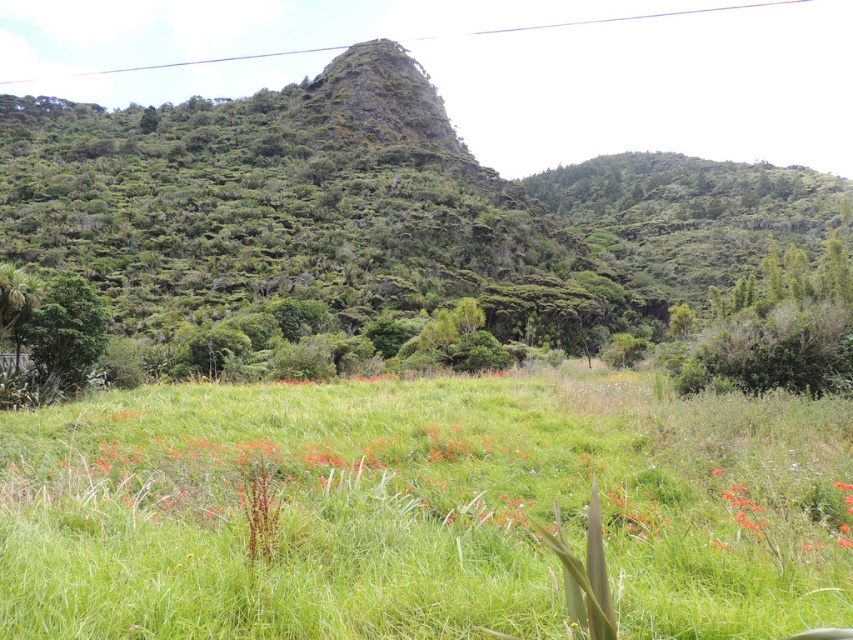
You are standing at the edge of the green grassy field at center and want to walk to the green leafy tree at left. Which direction should you head to reach the tree first?

The green grassy field at center is wider than the green leafy tree at left, so you should head towards the left direction to reach the tree first.